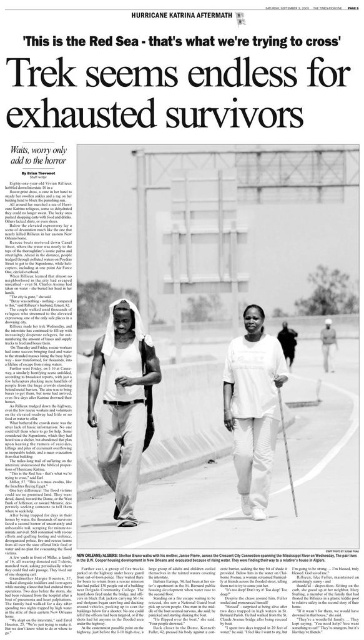
Based on the scene described in the newspaper clipping from The Times Picayune, can you determine which bag is closer to the viewer between the white plastic bag at center and the dark brown leather bag at center?

The white plastic bag at center is closer to the viewer because the dark brown leather bag at center is behind it.

Based on the scene described in the newspaper clipping from The Times Picayune, which object is smaller between the white cotton tank top at center and the dark brown leather bag at center?

The white cotton tank top at center is smaller than the dark brown leather bag at center.

Based on the scene described in the newspaper clipping from The Times Picayune, which object is positioned lower on the image between the white cotton tank top at center and the white plastic bag at center?

The white cotton tank top at center is located below the white plastic bag at center, so it is positioned lower in the image.